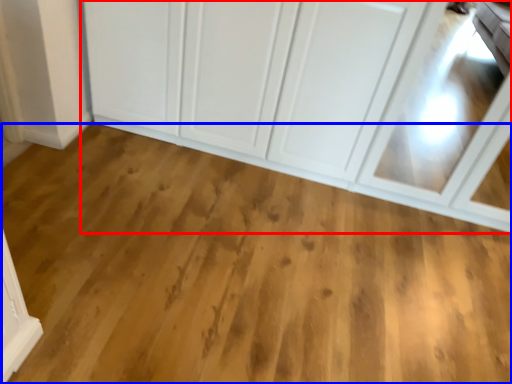
Question: Which object appears closest to the camera in this image, cupboard (highlighted by a red box) or plain (highlighted by a blue box)?

Choices:
 (A) cupboard
 (B) plain

Answer: (B)